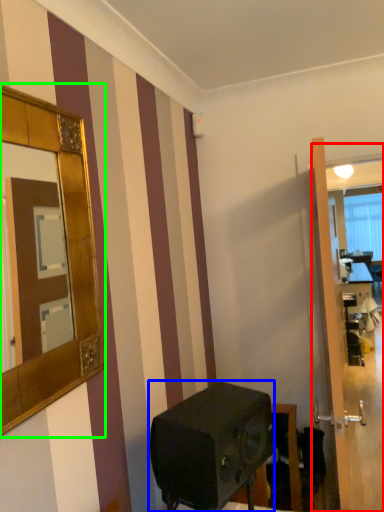
Question: Which object is positioned closest to glass door (highlighted by a red box)? Select from appliance (highlighted by a blue box) and mirror (highlighted by a green box).

Choices:
 (A) appliance
 (B) mirror

Answer: (A)